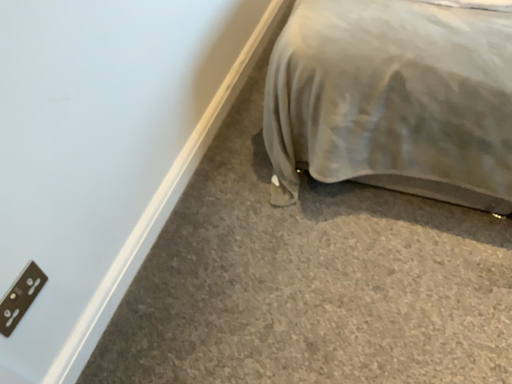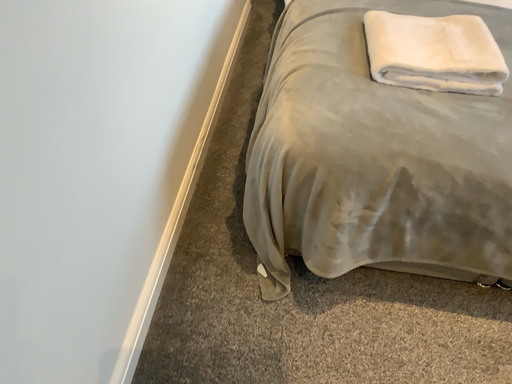
Question: Which way did the camera rotate in the video?

Choices:
 (A) rotated right
 (B) rotated left

Answer: (A)